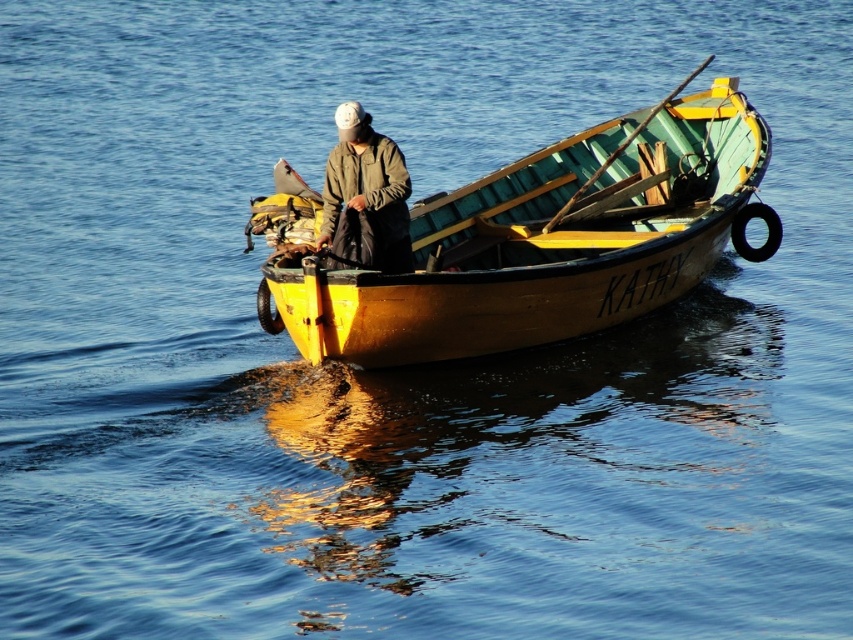
Does point (548, 323) come in front of point (343, 172)?

Yes, it is in front of point (343, 172).

Does wooden boat at center have a lesser width compared to green matte jacket at center?

No, wooden boat at center is not thinner than green matte jacket at center.

Which is behind, point (405, 292) or point (360, 156)?

The point (360, 156) is behind.

The image size is (853, 640). Identify the location of wooden boat at center. (543, 241).